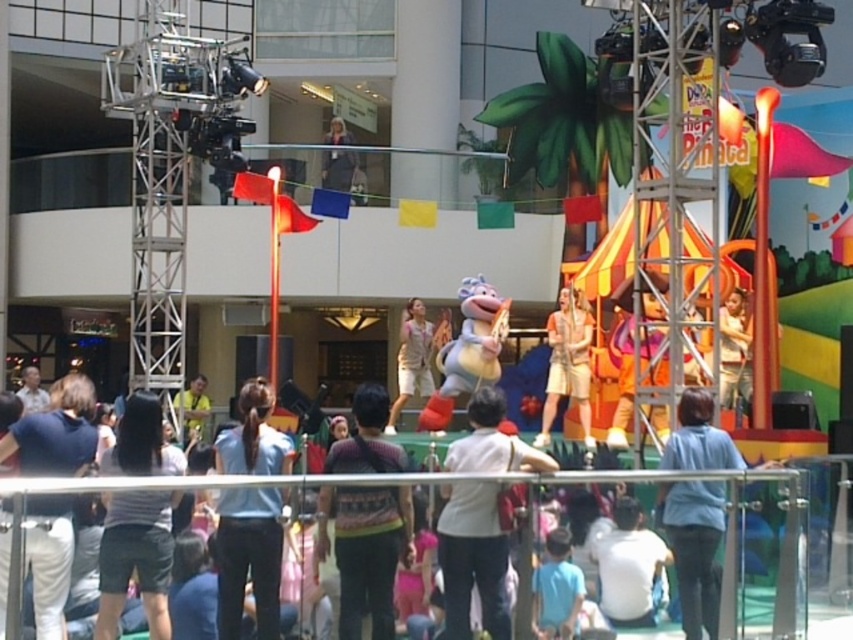
Question: Which of these objects is positioned farthest from the beige cotton shorts at center?

Choices:
 (A) yellow fabric at center
 (B) striped fabric shirt at center
 (C) blue cotton shirt at lower center
 (D) white cotton shirt at lower left

Answer: (D)

Question: Which object appears farthest from the camera in this image?

Choices:
 (A) blue fabric shirt at lower center
 (B) light brown fabric shirt at upper center
 (C) light beige fabric dress at center
 (D) yellow fabric at center

Answer: (B)

Question: Based on their relative distances, which object is nearer to the white cotton shirt at lower left?

Choices:
 (A) white matte shirt at center
 (B) blue cotton shirt at lower center
 (C) beige cotton shorts at center

Answer: (A)

Question: Is blue cotton shirt at lower center in front of beige cotton shorts at center?

Choices:
 (A) yes
 (B) no

Answer: (A)

Question: Is white matte shirt at center to the left of dark gray shorts at lower left from the viewer's perspective?

Choices:
 (A) yes
 (B) no

Answer: (B)

Question: Can you confirm if white matte shirt at center is bigger than blue cotton shirt at lower center?

Choices:
 (A) yes
 (B) no

Answer: (A)